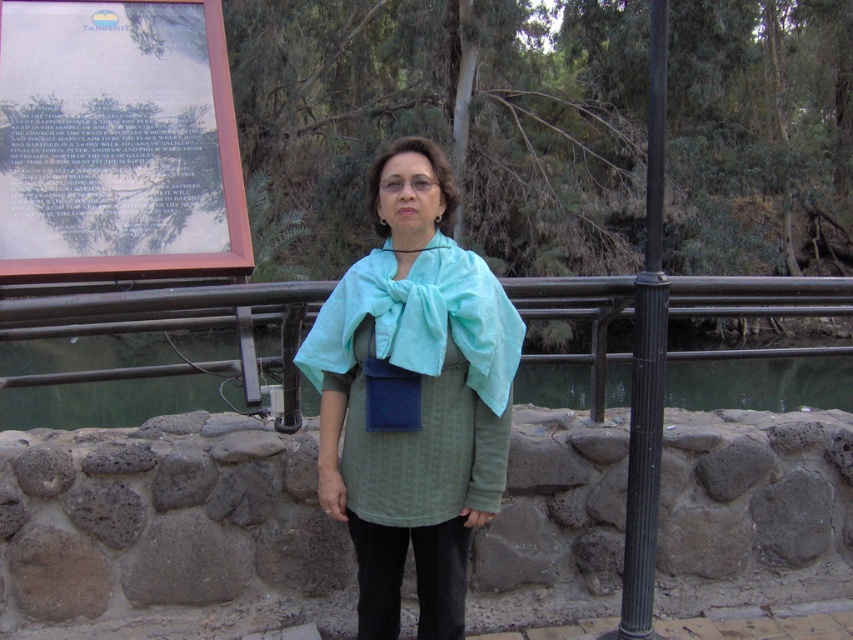
You are standing in the same spot as the person in the image and want to read the wooden signboard at upper left. If your arm reaches 2.5 meters when fully extended, can you touch the signboard with your hand?

The wooden signboard at upper left is 3.09 meters away from the viewer. Since your arm only reaches 2.5 meters when fully extended, you cannot touch the signboard with your hand.